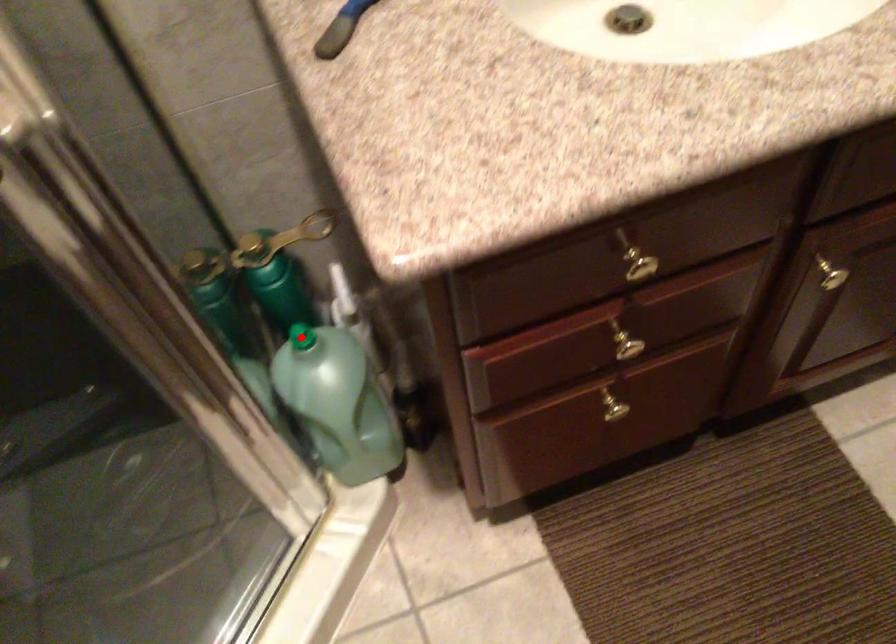
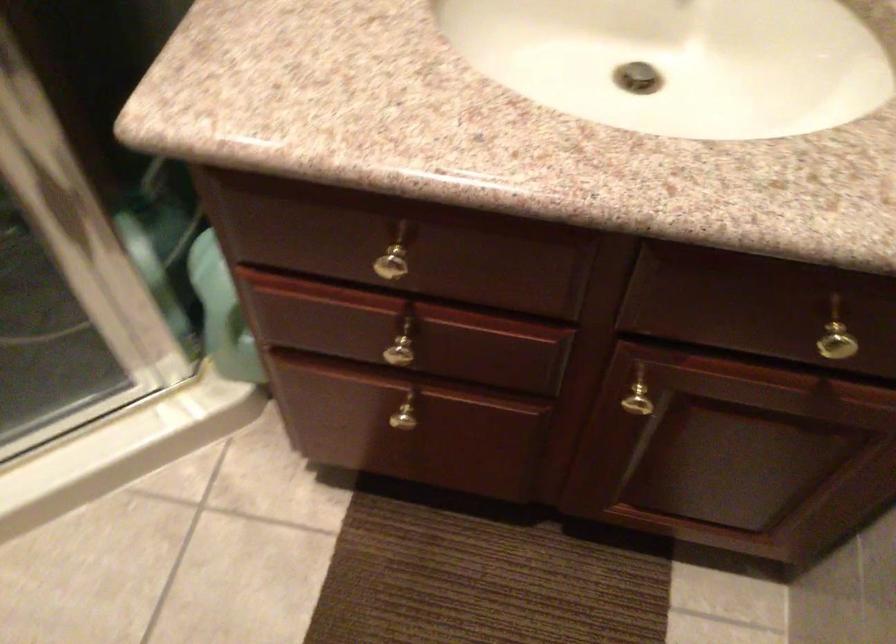
Question: I am providing you with two images of the same scene from different viewpoints. A red point is marked on the first image. Can you still see the location of the red point in image 2?

Choices:
 (A) Yes
 (B) No

Answer: (B)